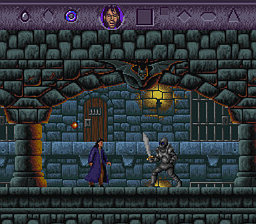
At what (x,y) coordinates should I click in order to perform the action: click on door. Please return your answer as a coordinate pair (x, y). The height and width of the screenshot is (224, 256). Looking at the image, I should click on pyautogui.click(x=100, y=122).